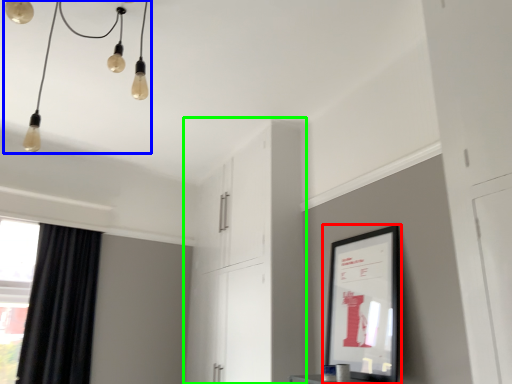
Question: Estimate the real-world distances between objects in this image. Which object is farther from picture frame (highlighted by a red box), light fixture (highlighted by a blue box) or dresser (highlighted by a green box)?

Choices:
 (A) light fixture
 (B) dresser

Answer: (A)